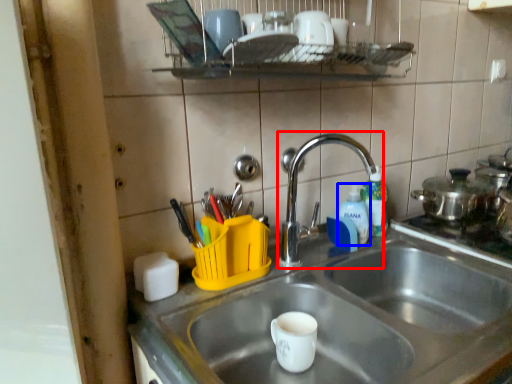
Question: Among these objects, which one is farthest to the camera, tap (highlighted by a red box) or bottle (highlighted by a blue box)?

Choices:
 (A) tap
 (B) bottle

Answer: (B)